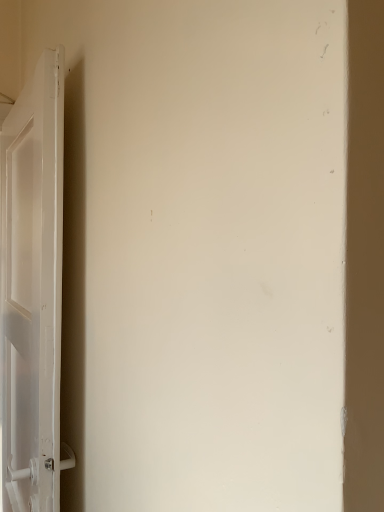
Measure the distance between point (50,244) and camera.

Point (50,244) and camera are 36.10 inches apart from each other.

The image size is (384, 512). What do you see at coordinates (32, 291) in the screenshot?
I see `white matte door at left` at bounding box center [32, 291].

The image size is (384, 512). What are the coordinates of `white matte door at left` in the screenshot? It's located at (32, 291).

You are a GUI agent. You are given a task and a screenshot of the screen. Output one action in this format:
    pyautogui.click(x=<x>, y=<y>)
    Task: Click on the white matte door at left
    
    Given the screenshot: What is the action you would take?
    pyautogui.click(x=32, y=291)